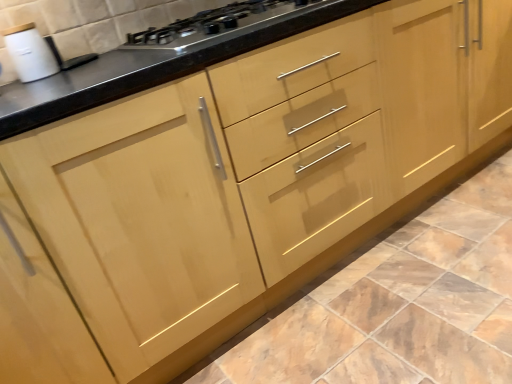
This screenshot has width=512, height=384. Identify the location of white glossy sink at upper left. (37, 54).

The height and width of the screenshot is (384, 512). I want to click on satin black gas stove at upper center, so click(x=212, y=23).

Locate an element on the screen. This screenshot has height=384, width=512. matte brown cabinet at center is located at coordinates [x=396, y=306].

Which object is positioned more to the right, matte brown cabinet at center or satin black gas stove at upper center?

matte brown cabinet at center.

From a real-world perspective, relative to satin black gas stove at upper center, is matte brown cabinet at center vertically above or below?

matte brown cabinet at center is below satin black gas stove at upper center.

Is matte brown cabinet at center not close to satin black gas stove at upper center?

No, matte brown cabinet at center is not far away from satin black gas stove at upper center.

Is point (510, 203) closer to viewer compared to point (221, 24)?

No.

How many degrees apart are the facing directions of satin black gas stove at upper center and white glossy sink at upper left?

The angle between the facing direction of satin black gas stove at upper center and the facing direction of white glossy sink at upper left is 4.16 degrees.

Is satin black gas stove at upper center to the right of white glossy sink at upper left from the viewer's perspective?

Indeed, satin black gas stove at upper center is positioned on the right side of white glossy sink at upper left.

Between satin black gas stove at upper center and white glossy sink at upper left, which one has more height?

Standing taller between the two is white glossy sink at upper left.

Considering the sizes of satin black gas stove at upper center and white glossy sink at upper left in the image, is satin black gas stove at upper center bigger or smaller than white glossy sink at upper left?

In the image, satin black gas stove at upper center appears to be larger than white glossy sink at upper left.

Identify the location of ceramic tile that appears on the right of white glossy sink at upper left. The width and height of the screenshot is (512, 384). (396, 306).

From the image's perspective, is white glossy sink at upper left on matte brown cabinet at center?

Yes.

How many degrees apart are the facing directions of white glossy sink at upper left and matte brown cabinet at center?

The facing directions of white glossy sink at upper left and matte brown cabinet at center are 176 degrees apart.

Which is correct: matte brown cabinet at center is inside white glossy sink at upper left, or outside of it?

matte brown cabinet at center is not inside white glossy sink at upper left, it's outside.

Does point (504, 368) appear closer or farther from the camera than point (39, 38)?

Point (504, 368).

Looking at this image, from a real-world perspective, which object rests below the other?

matte brown cabinet at center, from a real-world perspective.

From the picture: Between matte brown cabinet at center and white glossy sink at upper left, which one appears on the left side from the viewer's perspective?

Positioned to the left is white glossy sink at upper left.

From a real-world perspective, is satin black gas stove at upper center beneath matte brown cabinet at center?

Actually, satin black gas stove at upper center is physically above matte brown cabinet at center in the real world.

Can you tell me how much satin black gas stove at upper center and matte brown cabinet at center differ in facing direction?

There is a 180-degree angle between the facing directions of satin black gas stove at upper center and matte brown cabinet at center.

How far apart are satin black gas stove at upper center and matte brown cabinet at center?

satin black gas stove at upper center is 38.91 inches away from matte brown cabinet at center.

From the image's perspective, which is above, satin black gas stove at upper center or matte brown cabinet at center?

satin black gas stove at upper center, from the image's perspective.

Locate an element on the screen. gas stove in front of the white glossy sink at upper left is located at coordinates (212, 23).

How many degrees apart are the facing directions of white glossy sink at upper left and satin black gas stove at upper center?

The facing directions of white glossy sink at upper left and satin black gas stove at upper center are 4.16 degrees apart.

From the image's perspective, which one is positioned lower, white glossy sink at upper left or satin black gas stove at upper center?

white glossy sink at upper left appears lower in the image.

Based on the photo, from a real-world perspective, which is physically above, white glossy sink at upper left or satin black gas stove at upper center?

white glossy sink at upper left, from a real-world perspective.

Locate an element on the screen. This screenshot has height=384, width=512. ceramic tile in front of the satin black gas stove at upper center is located at coordinates (396, 306).

Locate an element on the screen. gas stove on the right of white glossy sink at upper left is located at coordinates (212, 23).

From the image, which object appears to be farther from satin black gas stove at upper center, matte brown cabinet at center or white glossy sink at upper left?

matte brown cabinet at center is positioned further to the anchor satin black gas stove at upper center.

Which object lies nearer to the anchor point satin black gas stove at upper center, white glossy sink at upper left or matte brown cabinet at center?

white glossy sink at upper left is positioned closer to the anchor satin black gas stove at upper center.

Based on their spatial positions, is white glossy sink at upper left or satin black gas stove at upper center further from matte brown cabinet at center?

Among the two, white glossy sink at upper left is located further to matte brown cabinet at center.

Considering their positions, is satin black gas stove at upper center positioned closer to white glossy sink at upper left than matte brown cabinet at center?

satin black gas stove at upper center.

Looking at the image, which one is located further to white glossy sink at upper left, matte brown cabinet at center or satin black gas stove at upper center?

Based on the image, matte brown cabinet at center appears to be further to white glossy sink at upper left.

Looking at the image, which one is located further to matte brown cabinet at center, satin black gas stove at upper center or white glossy sink at upper left?

white glossy sink at upper left is positioned further to the anchor matte brown cabinet at center.

The image size is (512, 384). I want to click on gas stove situated between white glossy sink at upper left and matte brown cabinet at center from left to right, so click(x=212, y=23).